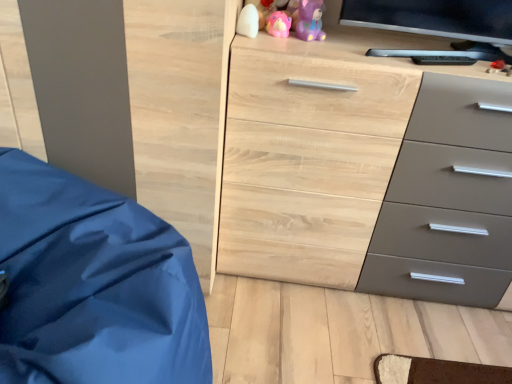
Question: Is pink rubber duck at upper center, which is counted as the 2th toy, starting from the right, taller than white matte pillow at upper center, which appears as the 1th toy when viewed from the left?

Choices:
 (A) yes
 (B) no

Answer: (B)

Question: Considering the relative positions of pink rubber duck at upper center, which is counted as the 2th toy, starting from the right, and white matte pillow at upper center, the 3th toy in the right-to-left sequence, in the image provided, is pink rubber duck at upper center, which is counted as the 2th toy, starting from the right, to the left of white matte pillow at upper center, the 3th toy in the right-to-left sequence, from the viewer's perspective?

Choices:
 (A) yes
 (B) no

Answer: (B)

Question: From the image's perspective, is pink rubber duck at upper center, the second toy from the left, over white matte pillow at upper center, the 3th toy in the right-to-left sequence?

Choices:
 (A) no
 (B) yes

Answer: (B)

Question: From a real-world perspective, is pink rubber duck at upper center, the second toy from the left, on white matte pillow at upper center, the 3th toy in the right-to-left sequence?

Choices:
 (A) no
 (B) yes

Answer: (B)

Question: Could white matte pillow at upper center, which appears as the 1th toy when viewed from the left, be considered to be inside pink rubber duck at upper center, which is counted as the 2th toy, starting from the right?

Choices:
 (A) yes
 (B) no

Answer: (B)

Question: Is white matte pillow at upper center, which appears as the 1th toy when viewed from the left, spatially inside light wood/texture chest of drawers at center, or outside of it?

Choices:
 (A) inside
 (B) outside

Answer: (B)

Question: From the image's perspective, is white matte pillow at upper center, the 3th toy in the right-to-left sequence, located above or below light wood/texture chest of drawers at center?

Choices:
 (A) below
 (B) above

Answer: (B)

Question: From a real-world perspective, relative to light wood/texture chest of drawers at center, is white matte pillow at upper center, which appears as the 1th toy when viewed from the left, vertically above or below?

Choices:
 (A) above
 (B) below

Answer: (A)

Question: Considering the positions of white matte pillow at upper center, which appears as the 1th toy when viewed from the left, and light wood/texture chest of drawers at center in the image, is white matte pillow at upper center, which appears as the 1th toy when viewed from the left, wider or thinner than light wood/texture chest of drawers at center?

Choices:
 (A) wide
 (B) thin

Answer: (B)

Question: Considering their positions, is purple matte bear at upper center, acting as the first toy starting from the right, located in front of or behind white matte pillow at upper center, which appears as the 1th toy when viewed from the left?

Choices:
 (A) front
 (B) behind

Answer: (B)

Question: Is purple matte bear at upper center, the third toy when ordered from left to right, situated inside white matte pillow at upper center, the 3th toy in the right-to-left sequence, or outside?

Choices:
 (A) outside
 (B) inside

Answer: (A)

Question: In terms of width, does purple matte bear at upper center, the third toy when ordered from left to right, look wider or thinner when compared to white matte pillow at upper center, which appears as the 1th toy when viewed from the left?

Choices:
 (A) wide
 (B) thin

Answer: (A)

Question: From a real-world perspective, is purple matte bear at upper center, acting as the first toy starting from the right, physically located above or below white matte pillow at upper center, which appears as the 1th toy when viewed from the left?

Choices:
 (A) above
 (B) below

Answer: (A)

Question: Relative to purple matte bear at upper center, acting as the first toy starting from the right, is light wood/texture chest of drawers at center in front or behind?

Choices:
 (A) behind
 (B) front

Answer: (B)

Question: From a real-world perspective, relative to purple matte bear at upper center, acting as the first toy starting from the right, is light wood/texture chest of drawers at center vertically above or below?

Choices:
 (A) above
 (B) below

Answer: (B)